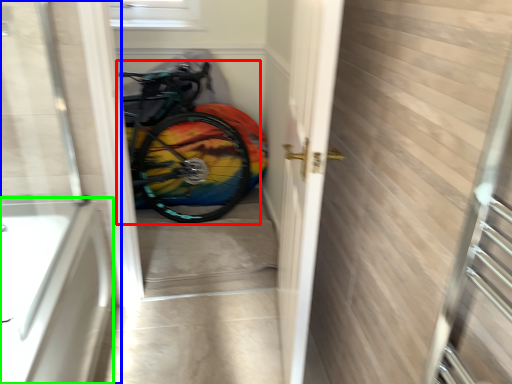
Question: Which object is the farthest from bicycle (highlighted by a red box)? Choose among these: door (highlighted by a blue box) or bath (highlighted by a green box).

Choices:
 (A) door
 (B) bath

Answer: (B)